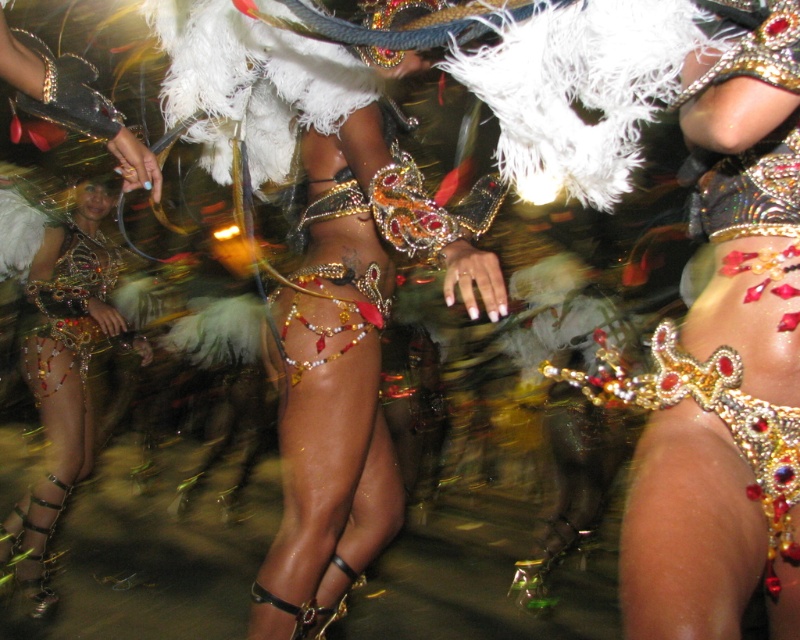
Question: Can you confirm if shiny gold bikini at center is positioned above metallic gold bikini at center?

Choices:
 (A) yes
 (B) no

Answer: (A)

Question: Which object appears closest to the camera in this image?

Choices:
 (A) shiny gold bikini at center
 (B) metallic gold bikini at center

Answer: (A)

Question: Can you confirm if shiny gold bikini at center is positioned below metallic gold bikini at center?

Choices:
 (A) yes
 (B) no

Answer: (B)

Question: Is shiny gold bikini at center smaller than metallic gold bikini at center?

Choices:
 (A) yes
 (B) no

Answer: (B)